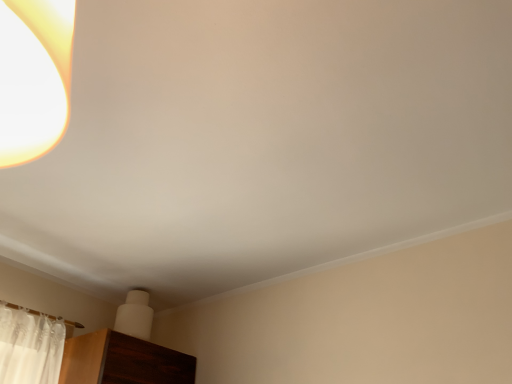
Question: Should I look upward or downward to see white matte lampshade at upper left?

Choices:
 (A) up
 (B) down

Answer: (B)